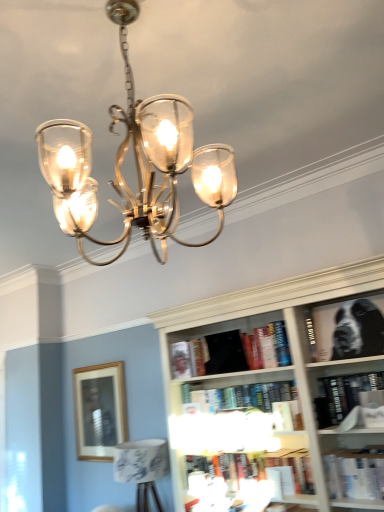
Question: Can you confirm if white paper book at lower right, which ranks as the second book in bottom-to-top order, is positioned to the right of hardcover book at center, which ranks as the 3th book in top-to-bottom order?

Choices:
 (A) no
 (B) yes

Answer: (B)

Question: Is white paper book at lower right, which ranks as the second book in bottom-to-top order, turned away from hardcover book at center, which ranks as the 3th book in top-to-bottom order?

Choices:
 (A) no
 (B) yes

Answer: (A)

Question: Considering the relative sizes of white paper book at lower right, which ranks as the second book in bottom-to-top order, and hardcover book at center, which ranks as the 3th book in top-to-bottom order, in the image provided, is white paper book at lower right, which ranks as the second book in bottom-to-top order, wider than hardcover book at center, which ranks as the 3th book in top-to-bottom order,?

Choices:
 (A) yes
 (B) no

Answer: (A)

Question: From a real-world perspective, is white paper book at lower right, which is counted as the sixth book, starting from the top, beneath hardcover book at center, marked as the 5th book in a bottom-to-top arrangement?

Choices:
 (A) no
 (B) yes

Answer: (B)

Question: From the image's perspective, does white paper book at lower right, which is counted as the sixth book, starting from the top, appear lower than hardcover book at center, which ranks as the 3th book in top-to-bottom order?

Choices:
 (A) yes
 (B) no

Answer: (A)

Question: Is white paper book at lower right, which is counted as the sixth book, starting from the top, shorter than hardcover book at center, marked as the 5th book in a bottom-to-top arrangement?

Choices:
 (A) no
 (B) yes

Answer: (B)

Question: Is wooden picture frame at center left positioned in front of hardcover book at center, which ranks as the 3th book in top-to-bottom order?

Choices:
 (A) yes
 (B) no

Answer: (B)

Question: Could you tell me if wooden picture frame at center left is turned towards hardcover book at center, marked as the 5th book in a bottom-to-top arrangement?

Choices:
 (A) yes
 (B) no

Answer: (B)

Question: Is wooden picture frame at center left bigger than hardcover book at center, which ranks as the 3th book in top-to-bottom order?

Choices:
 (A) no
 (B) yes

Answer: (B)

Question: Does wooden picture frame at center left come behind hardcover book at center, which ranks as the 3th book in top-to-bottom order?

Choices:
 (A) no
 (B) yes

Answer: (B)

Question: Is wooden picture frame at center left surrounding hardcover book at center, marked as the 5th book in a bottom-to-top arrangement?

Choices:
 (A) no
 (B) yes

Answer: (A)

Question: From a real-world perspective, is wooden picture frame at center left under hardcover book at center, which ranks as the 3th book in top-to-bottom order?

Choices:
 (A) yes
 (B) no

Answer: (A)

Question: Could you tell me if black matte bookshelf at upper right, positioned as the first book in top-to-bottom order, is facing hardcover book at center, which appears as the 4th book when ordered from the bottom?

Choices:
 (A) no
 (B) yes

Answer: (A)